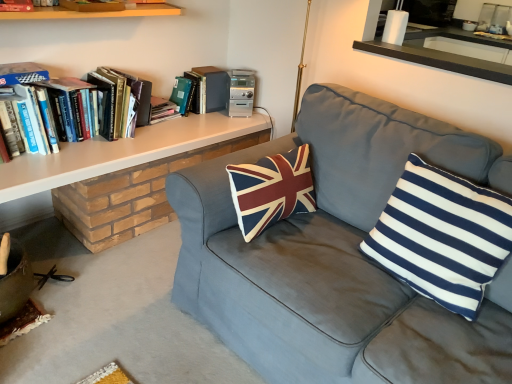
Locate an element on the screen. The height and width of the screenshot is (384, 512). empty space that is in between hardcover book at upper center, the 4th book positioned from the front, and hardcover book at upper left, which ranks as the second book in back-to-front order is located at coordinates (170, 120).